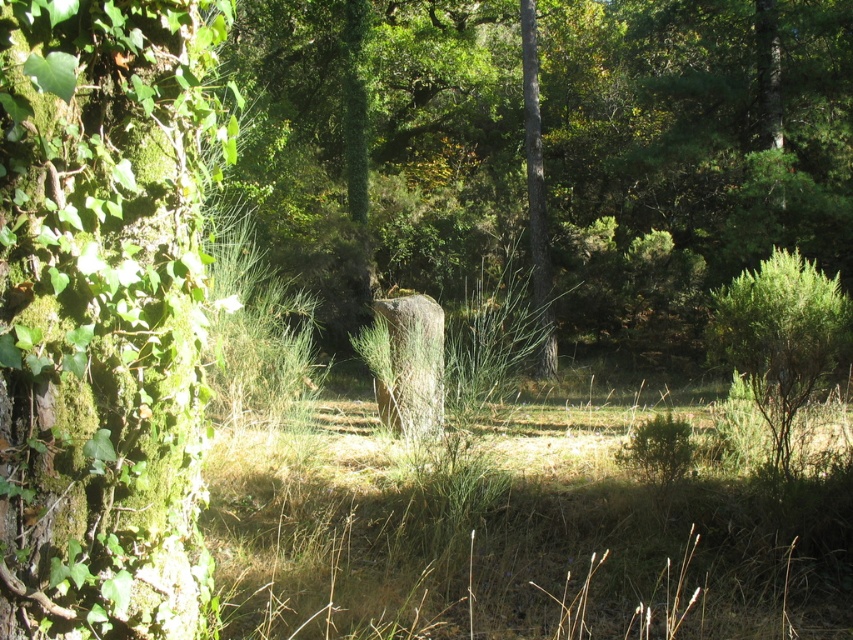
Question: Can you confirm if green mossy tree trunk at left is wider than brown dry grass at center?

Choices:
 (A) yes
 (B) no

Answer: (B)

Question: Is green mossy rock at center below green mossy tree trunk at left?

Choices:
 (A) yes
 (B) no

Answer: (B)

Question: Which is nearer to the green mossy rock at center?

Choices:
 (A) brown dry grass at center
 (B) green mossy tree trunk at left

Answer: (A)

Question: Which point is farther to the camera?

Choices:
 (A) green mossy rock at center
 (B) green mossy tree trunk at left
 (C) brown dry grass at center

Answer: (A)

Question: Can you confirm if green mossy rock at center is positioned below brown dry grass at center?

Choices:
 (A) yes
 (B) no

Answer: (B)

Question: Which of these objects is positioned closest to the brown dry grass at center?

Choices:
 (A) green mossy rock at center
 (B) green mossy tree trunk at left

Answer: (B)